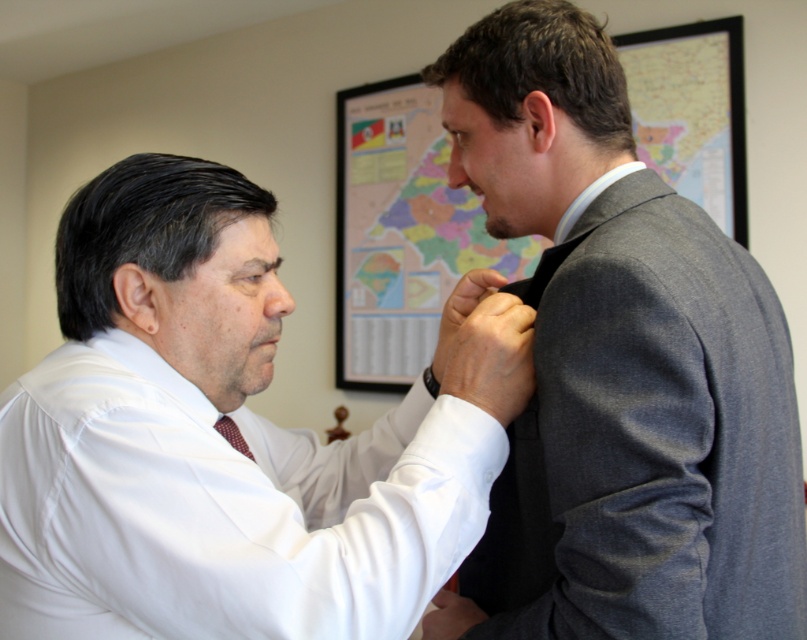
You are a tailor observing the two men in the office scene. You need to determine which item, the white smooth shirt at center or the maroon silk tie at center, requires more fabric to make. Based on their sizes, which one would you say needs more fabric?

The white smooth shirt at center has a larger size compared to the maroon silk tie at center, so it would require more fabric to make.

You are a tailor who needs to determine which item requires more fabric to alter between the gray wool suit at center and the maroon silk tie at center. Which one do you choose?

The gray wool suit at center has a larger size compared to the maroon silk tie at center, so the gray wool suit at center requires more fabric to alter.